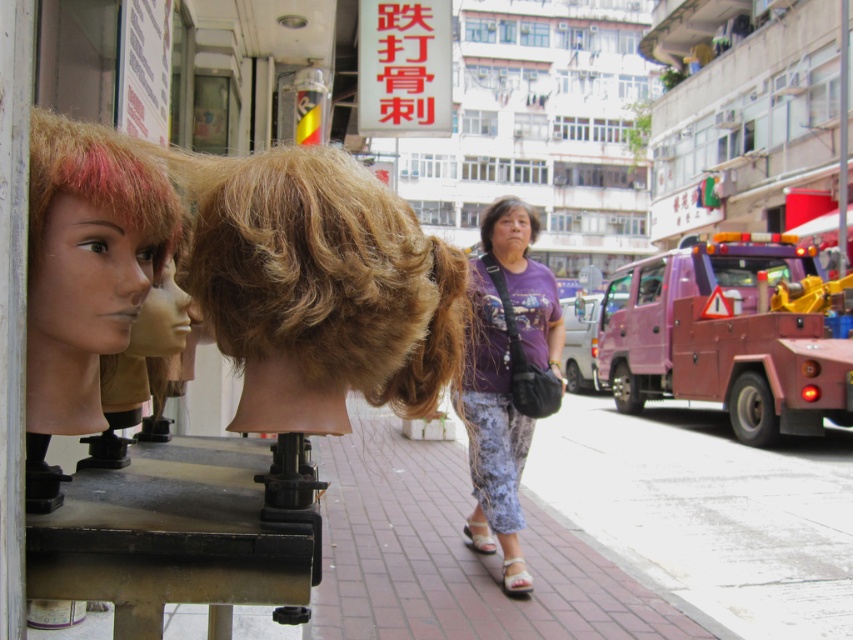
Question: Can you confirm if blonde synthetic wig at center is smaller than purple matte head at center?

Choices:
 (A) yes
 (B) no

Answer: (A)

Question: Which of the following is the closest to the observer?

Choices:
 (A) (561, 387)
 (B) (337, 310)

Answer: (B)

Question: Is purple fabric shirt at center to the right of purple matte head at center from the viewer's perspective?

Choices:
 (A) no
 (B) yes

Answer: (A)

Question: Where is blonde synthetic wig at center located in relation to purple matte head at center in the image?

Choices:
 (A) below
 (B) above

Answer: (A)

Question: Which of these objects is positioned farthest from the purple fabric shirt at center?

Choices:
 (A) blonde synthetic wig at center
 (B) purple matte head at center

Answer: (A)

Question: Considering the real-world distances, which object is farthest from the purple matte head at center?

Choices:
 (A) blonde synthetic wig at center
 (B) purple fabric shirt at center

Answer: (A)